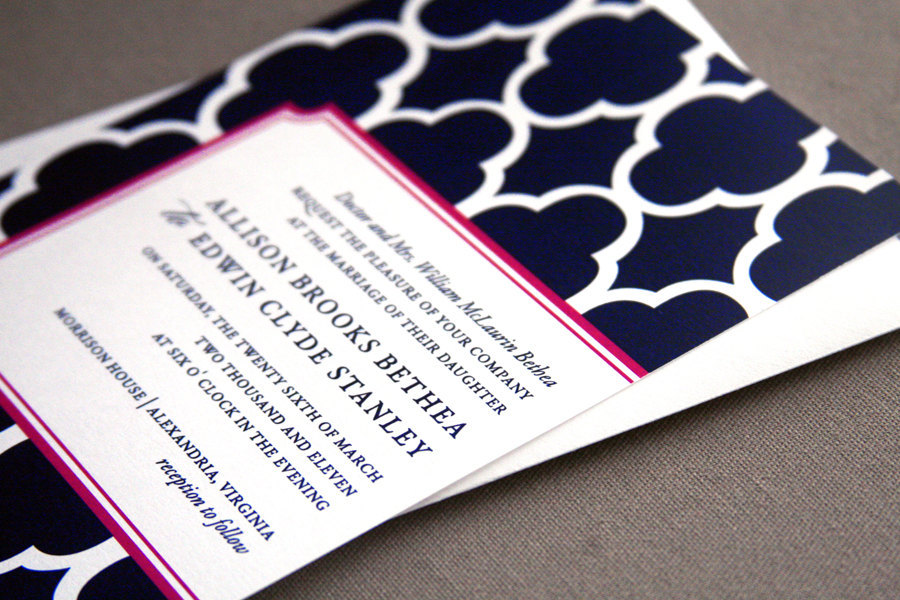
Find the location of a particular element. fabric is located at coordinates (754, 493).